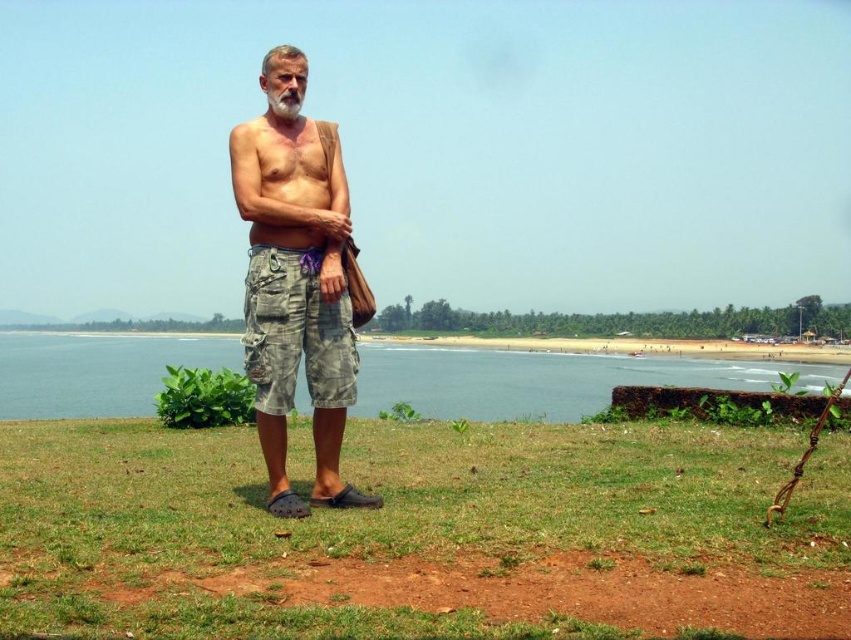
Question: Does green grass at center have a lesser width compared to camouflage shorts at center?

Choices:
 (A) no
 (B) yes

Answer: (A)

Question: Among these objects, which one is farthest from the camera?

Choices:
 (A) blue water at lower left
 (B) green grass at center
 (C) camouflage shorts at center
 (D) camouflage cargo shorts at center

Answer: (B)

Question: Is blue water at lower left wider than camouflage cargo shorts at center?

Choices:
 (A) no
 (B) yes

Answer: (B)

Question: Which of these objects is positioned farthest from the green grass at center?

Choices:
 (A) blue water at lower left
 (B) camouflage shorts at center

Answer: (A)

Question: Which object is the closest to the green grass at center?

Choices:
 (A) blue water at lower left
 (B) camouflage shorts at center
 (C) camouflage cargo shorts at center

Answer: (B)

Question: Is green grass at center thinner than camouflage shorts at center?

Choices:
 (A) yes
 (B) no

Answer: (B)